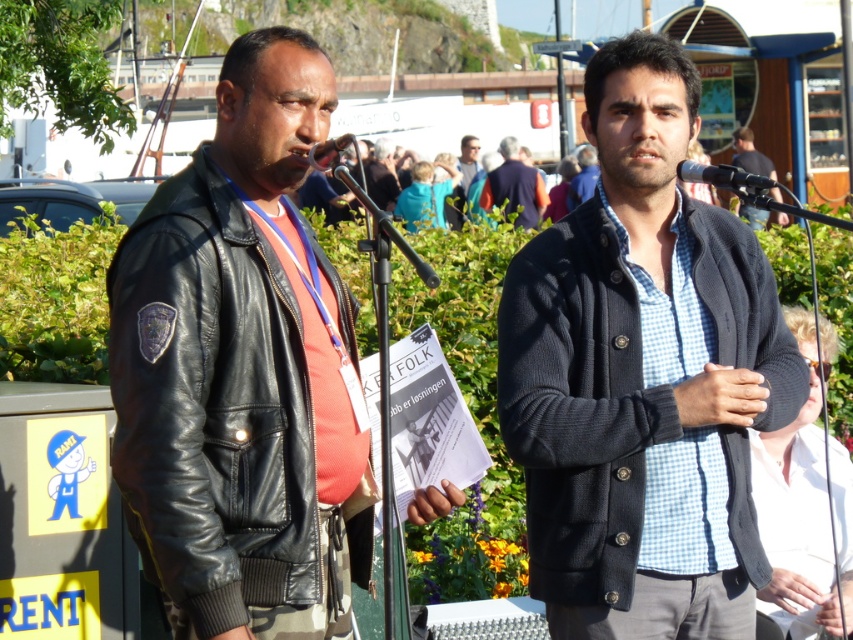
Consider the image. You are organizing a photo shoot and need to arrange two jackets on a mannequin stand. The stand has limited space. You have the light brown leather jacket at center and the black leather jacket at upper center. Which jacket should you choose to fit better on the stand if space is an issue?

The light brown leather jacket at center is smaller than the black leather jacket at upper center, so it would fit better on the mannequin stand with limited space.

You are organizing a photo shoot and need to place a 1.2 meter wide backdrop between the knitted dark gray sweater at center and the light brown leather jacket at center. Based on their widths, will the backdrop fit between them?

The knitted dark gray sweater at center might be wider than the light brown leather jacket at center, so the 1.2 meter wide backdrop may not fit between them if the total width of both objects exceeds 1.2 meters. However, since the exact widths aren not provided, it is uncertain.

You are at an outdoor event and see two jackets. The black leather jacket at left and the matte black jacket at center. Which jacket is positioned to the right?

The matte black jacket at center is positioned to the right of the black leather jacket at left.